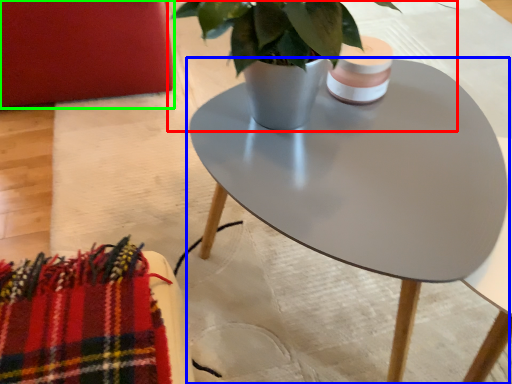
Question: Based on their relative distances, which object is nearer to houseplant (highlighted by a red box)? Choose from coffee table (highlighted by a blue box) and armchair (highlighted by a green box).

Choices:
 (A) coffee table
 (B) armchair

Answer: (A)